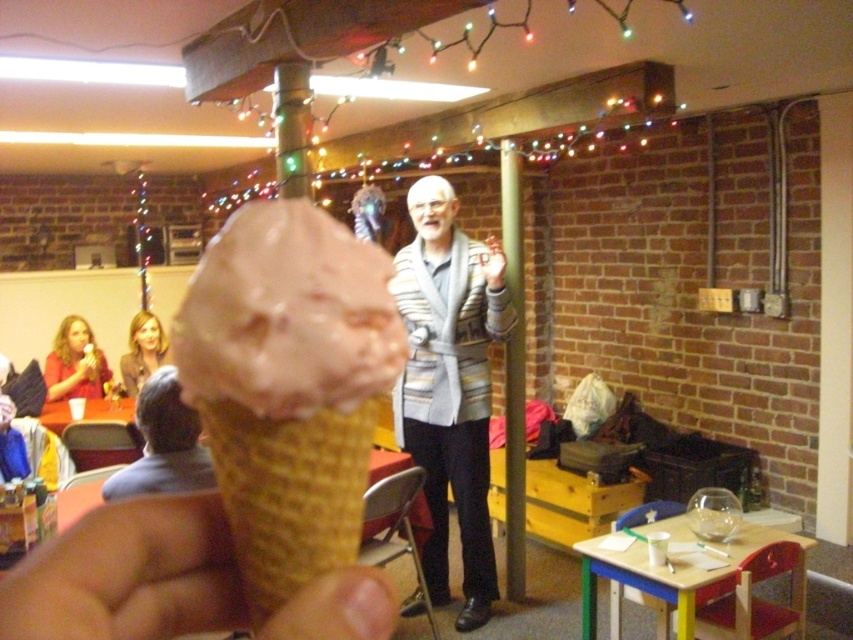
You are at an event where you are holding the light brown waffle cone at center. You want to toss it to the man in the striped sweater at center. Can you do this without moving from your current position?

The distance between the light brown waffle cone at center and the striped sweater at center is 8.60 feet, so yes, you can toss the light brown waffle cone at center to the man in the striped sweater at center from your current position since 8.60 feet is a manageable distance for a toss.

Consider the image. You are standing in the community gathering and want to take a photo. There are two points in the scene marked as point 1 at coordinates (440, 579) and point 2 at coordinates (143, 340). Which point will appear larger in your photo?

Point 1 at coordinates (440, 579) will appear larger in the photo because it is closer to the camera than point 2 at coordinates (143, 340).